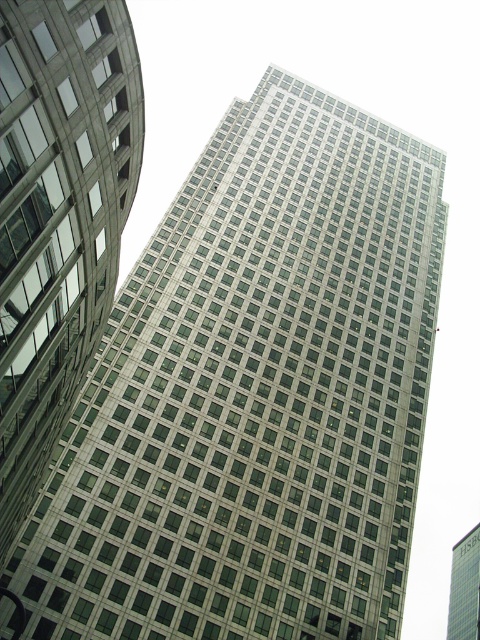
You are standing in front of two skyscrapers. The metallic glass skyscraper at center and the green glass skyscraper at center. Which one do you think is closer to you?

The metallic glass skyscraper at center is closer to the viewer than the green glass skyscraper at center.

You are standing at point A located at coordinates (58, 216) in the image. You want to take a photo of the metallic glass skyscraper at center. Can you see the metallic glass skyscraper at center from your current position?

Yes, the metallic glass skyscraper at center is located at point A, so you are standing directly at that location and can clearly see it.